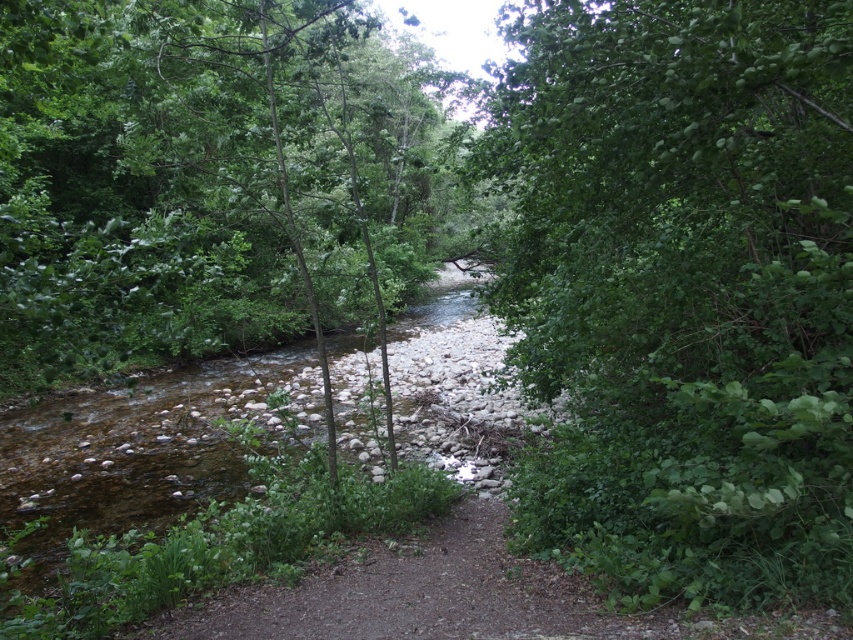
Question: Which of the following is the closest to the observer?

Choices:
 (A) green leafy tree at center
 (B) green leafy tree at right

Answer: (B)

Question: Can you confirm if green leafy tree at right is wider than green leafy tree at center?

Choices:
 (A) no
 (B) yes

Answer: (A)

Question: Can you confirm if green leafy tree at right is positioned below green leafy tree at center?

Choices:
 (A) no
 (B) yes

Answer: (B)

Question: Does green leafy tree at right have a larger size compared to green leafy tree at center?

Choices:
 (A) no
 (B) yes

Answer: (A)

Question: Among these objects, which one is nearest to the camera?

Choices:
 (A) green leafy tree at right
 (B) green leafy tree at center

Answer: (A)

Question: Which object appears farthest from the camera in this image?

Choices:
 (A) green leafy tree at right
 (B) green leafy tree at center

Answer: (B)